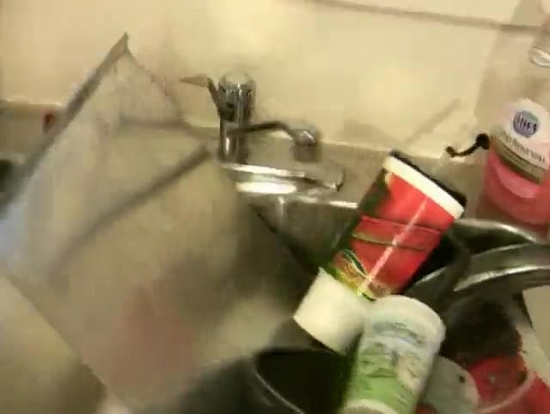
Identify the location of plastic cup. (398, 388).